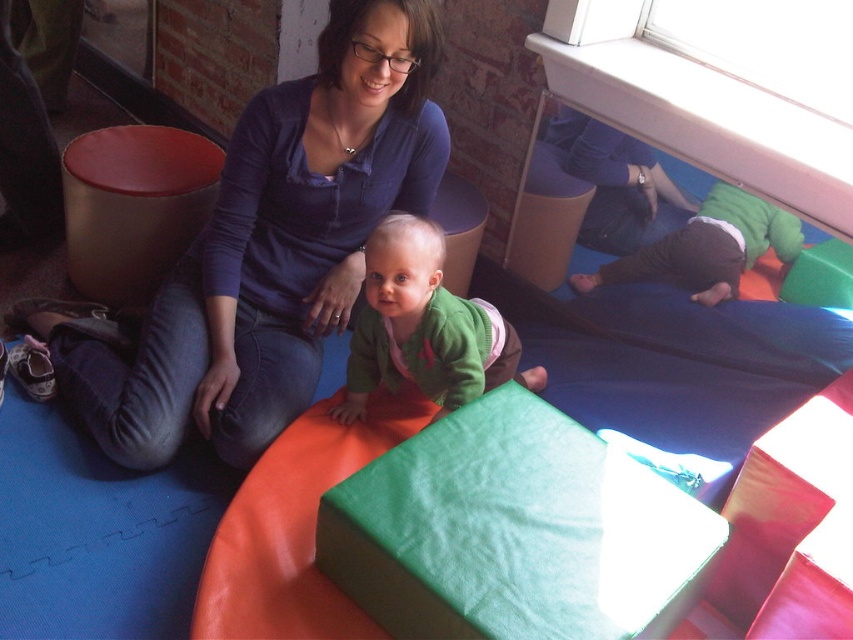
Can you confirm if matte blue shirt at upper center is positioned above green fabric cube at center?

Yes, matte blue shirt at upper center is above green fabric cube at center.

Is point (250, 275) positioned behind point (846, 253)?

That is True.

The image size is (853, 640). In order to click on matte blue shirt at upper center in this screenshot , I will do `click(270, 250)`.

Does green fuzzy sweater at lower right have a greater width compared to green fabric cube at center?

Yes.

Between point (653, 268) and point (824, 269), which one is positioned in front?

Point (824, 269) is more forward.

Who is more distant from viewer, (793, 246) or (817, 298)?

The point (793, 246) is more distant.

Locate an element on the screen. This screenshot has height=640, width=853. green fuzzy sweater at lower right is located at coordinates (706, 248).

In the scene shown: Does matte blue shirt at upper center have a lesser width compared to green fleece sweater at center?

No.

Is matte blue shirt at upper center below green fleece sweater at center?

Actually, matte blue shirt at upper center is above green fleece sweater at center.

Find the location of `matte blue shirt at upper center`. matte blue shirt at upper center is located at coordinates (270, 250).